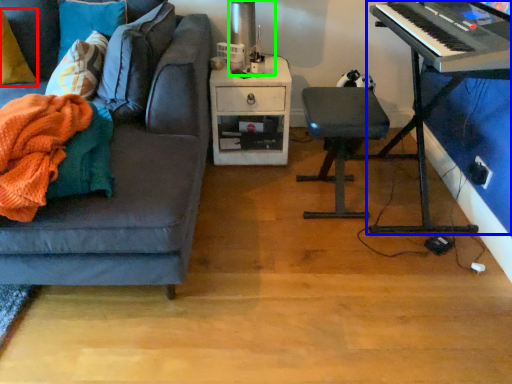
Question: Based on their relative distances, which object is farther from pillow (highlighted by a red box)? Choose from piano (highlighted by a blue box) and table lamp (highlighted by a green box).

Choices:
 (A) piano
 (B) table lamp

Answer: (A)